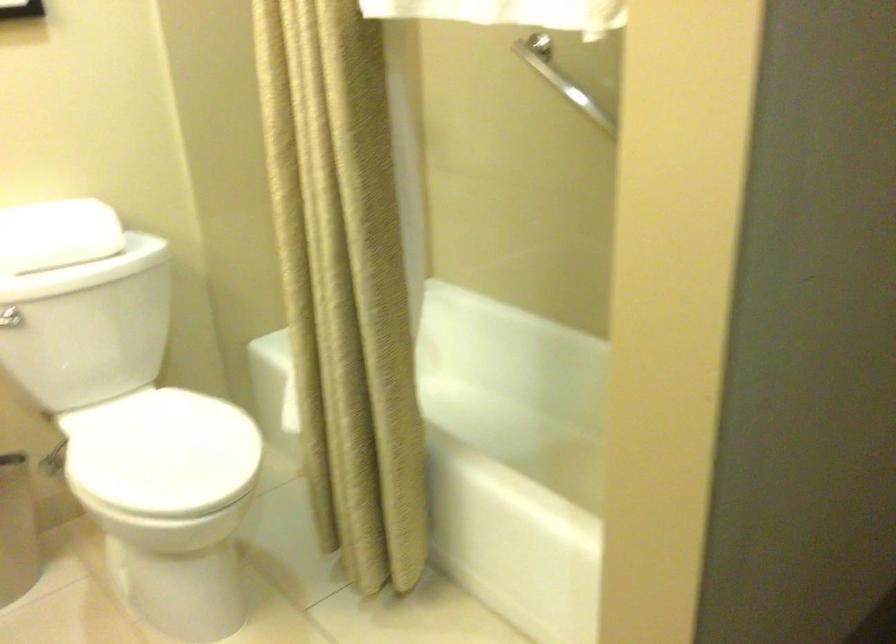
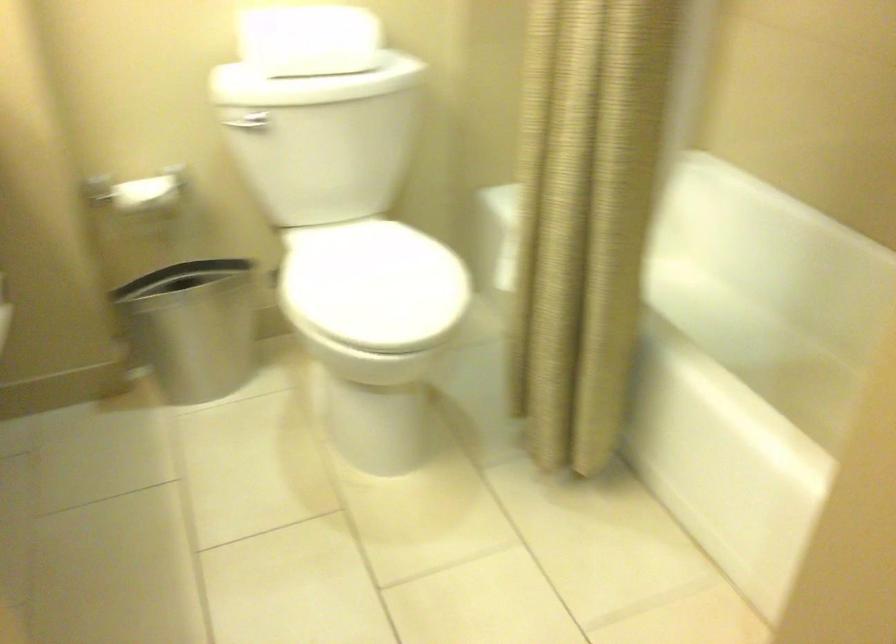
Question: Based on the continuous images, in which direction is the camera rotating? Reply with the corresponding letter.

Choices:
 (A) Left
 (B) Right
 (C) Up
 (D) Down

Answer: (A)